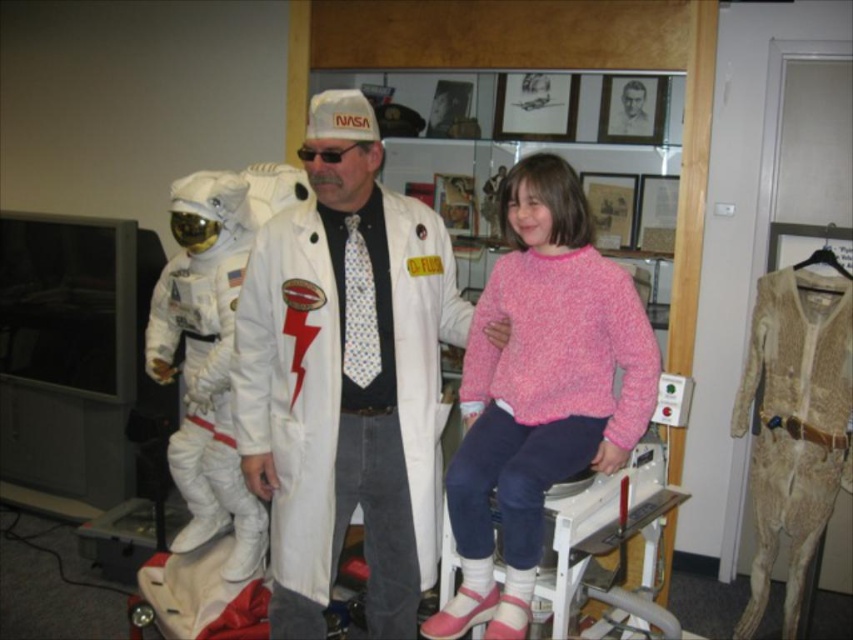
You are standing in the museum and want to take a photo of both the white matte lab coat at center and the white fabric astronaut suit at left. Which object should you focus on first to ensure both are in the frame?

You should focus on the white matte lab coat at center first since it is closer to you than the white fabric astronaut suit at left, ensuring both are in the frame.

Based on the coordinates provided, which object in the scene is located at point (346,378)?

The point (346,378) corresponds to the white matte lab coat at center.

You are standing in a museum and see the pink fuzzy sweater at center and the white fabric astronaut suit at left. Which object would appear larger to you?

The pink fuzzy sweater at center appears larger because it is closer to the viewer than the white fabric astronaut suit at left.